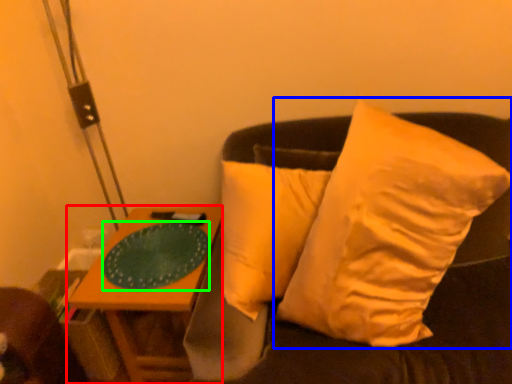
Question: Based on their relative distances, which object is nearer to table (highlighted by a red box)? Choose from pillow (highlighted by a blue box) and glass plate (highlighted by a green box).

Choices:
 (A) pillow
 (B) glass plate

Answer: (B)